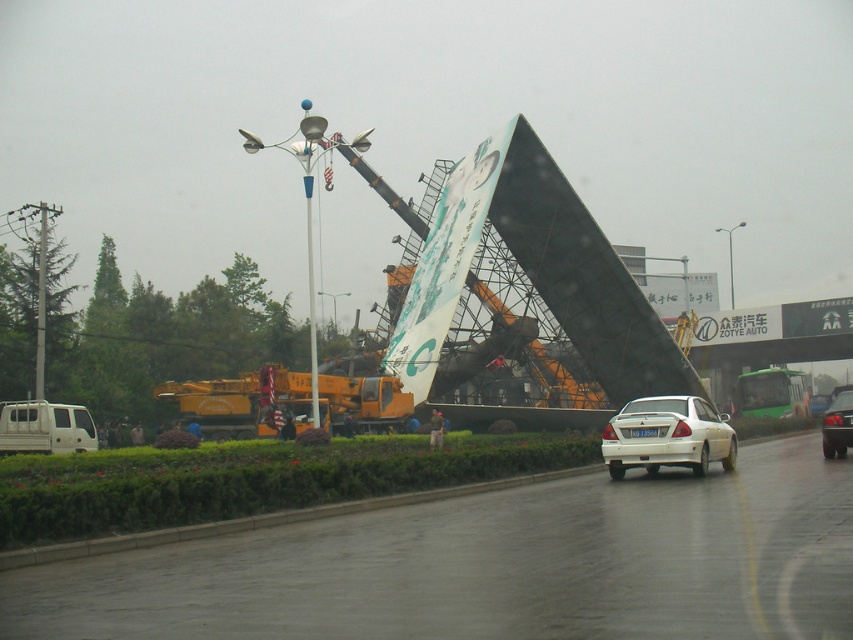
Question: Based on their relative distances, which object is nearer to the black asphalt road at center?

Choices:
 (A) shiny silver sedan at center
 (B) white matte van at lower left

Answer: (A)

Question: In this image, where is black asphalt road at center located relative to shiny silver sedan at center?

Choices:
 (A) right
 (B) left

Answer: (B)

Question: Which is farther from the white matte van at lower left?

Choices:
 (A) black asphalt road at center
 (B) white matte sedan at center

Answer: (A)

Question: Does black asphalt road at center lie behind white matte van at lower left?

Choices:
 (A) yes
 (B) no

Answer: (B)

Question: Which point appears closest to the camera in this image?

Choices:
 (A) (622, 412)
 (B) (834, 426)
 (C) (71, 413)

Answer: (A)

Question: Does white matte sedan at center have a greater width compared to shiny silver sedan at center?

Choices:
 (A) no
 (B) yes

Answer: (B)